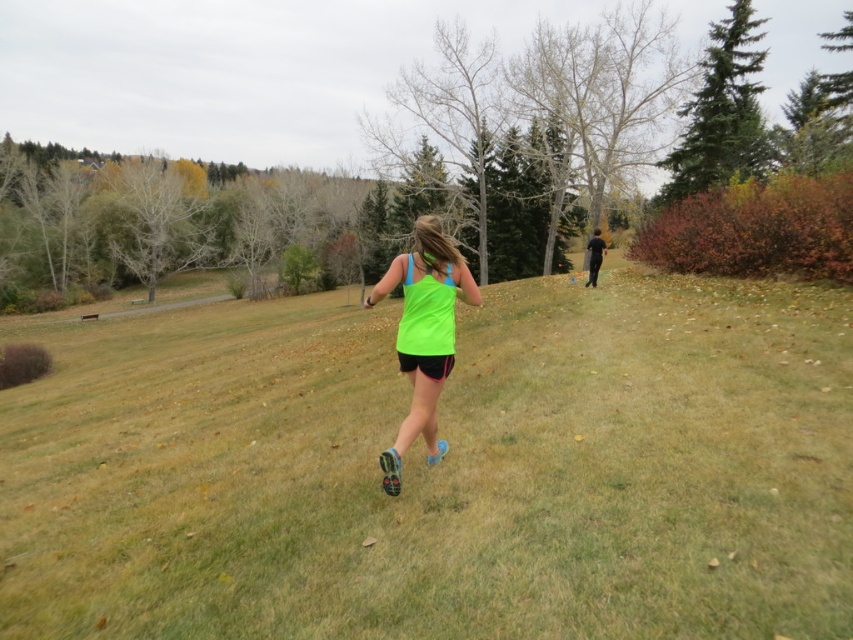
You are taking a photo of the jogging person in the park. You want to focus on the point closer to the camera between the two points labeled as point (618, 500) and point (426, 278). Which point should you select?

You should select point (618, 500) because it is closer to the camera than point (426, 278).

You are standing in the park and see the green grass at center and the neon green fabric tank top at center. Which object is positioned to the left of the other?

The green grass at center is to the left of neon green fabric tank top at center.

You are a photographer trying to capture a clear shot of the neon green fabric tank top at center. However, the green grass at center is obstructing your view. Can you determine if the grass is taller than the tank top?

The green grass at center is much taller than the neon green fabric tank top at center, so it will obstruct the view of the tank top.